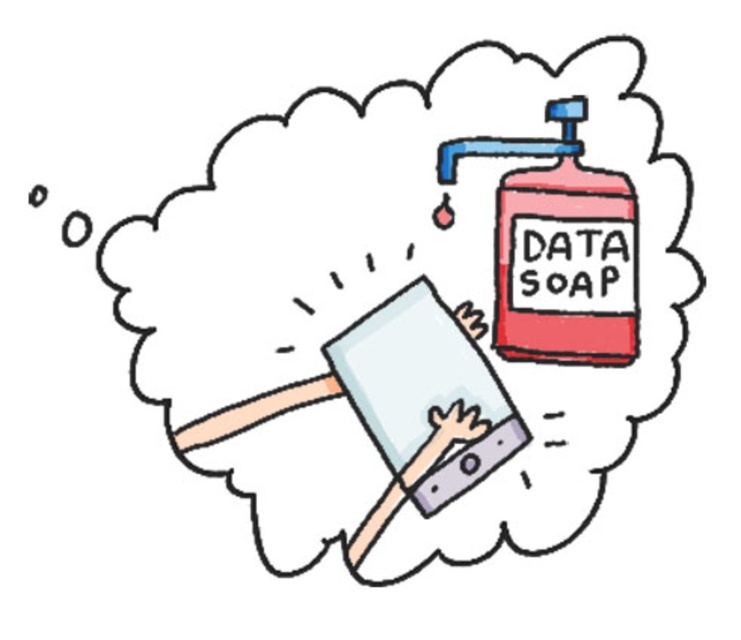
Question: Does white matte hand at center appear on the left side of smooth skin hand at center?

Choices:
 (A) no
 (B) yes

Answer: (B)

Question: Which object is farther from the camera taking this photo?

Choices:
 (A) matte red plastic data soap at upper right
 (B) matte gray hand at center
 (C) white matte hand at center

Answer: (B)

Question: Does matte red plastic data soap at upper right appear on the right side of matte gray hand at center?

Choices:
 (A) yes
 (B) no

Answer: (A)

Question: Which point is closer to the camera taking this photo?

Choices:
 (A) (459, 321)
 (B) (625, 205)

Answer: (B)

Question: Is the position of matte red plastic data soap at upper right less distant than that of matte gray hand at center?

Choices:
 (A) no
 (B) yes

Answer: (B)

Question: Which point is closer to the camera taking this photo?

Choices:
 (A) [x=456, y=406]
 (B) [x=608, y=280]
 (C) [x=451, y=312]

Answer: (B)